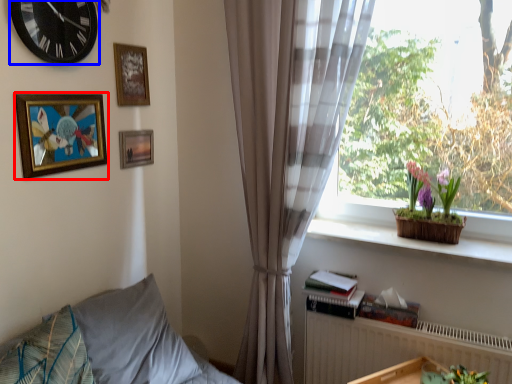
Question: Which object appears farthest to the camera in this image, picture frame (highlighted by a red box) or wall clock (highlighted by a blue box)?

Choices:
 (A) picture frame
 (B) wall clock

Answer: (A)